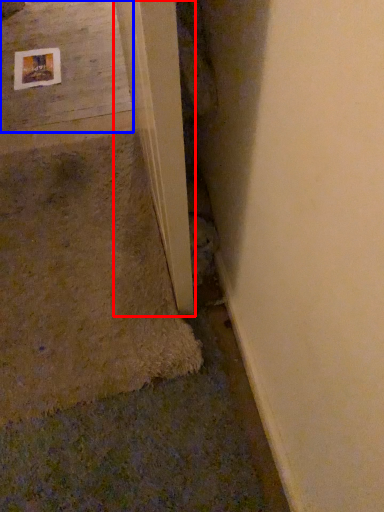
Question: Among these objects, which one is farthest to the camera, beam (highlighted by a red box) or concrete (highlighted by a blue box)?

Choices:
 (A) beam
 (B) concrete

Answer: (B)